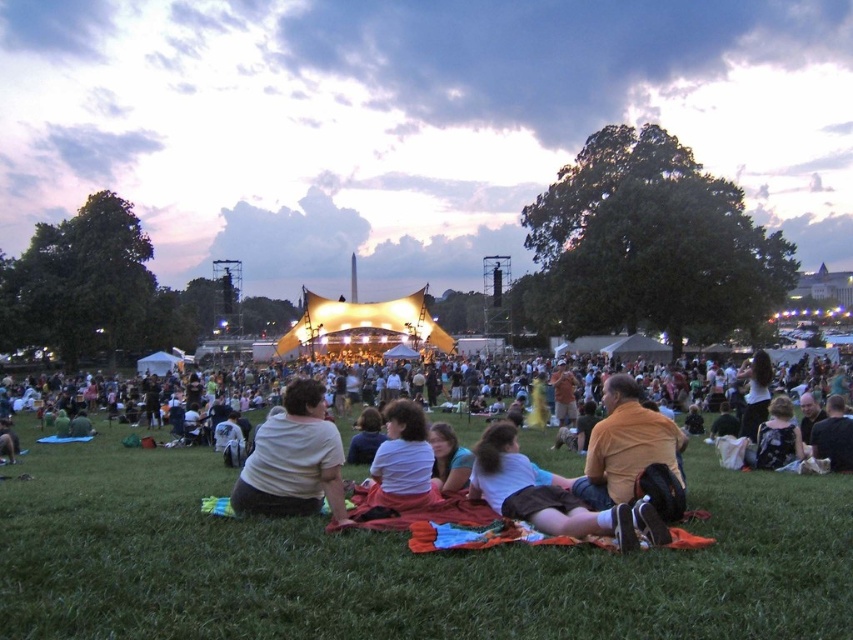
Question: Can you confirm if white matte shirt at center is positioned above light brown hair at center?

Choices:
 (A) no
 (B) yes

Answer: (B)

Question: Does orange cotton shirt at center appear under printed floral dress at lower right?

Choices:
 (A) yes
 (B) no

Answer: (A)

Question: Which point appears closest to the camera in this image?

Choices:
 (A) (0, 620)
 (B) (415, 403)
 (C) (786, 460)

Answer: (A)

Question: Which object is the farthest from the white cotton shirt at center?

Choices:
 (A) printed floral dress at lower right
 (B) light brown hair at center

Answer: (A)

Question: Which point is closer to the camera taking this photo?

Choices:
 (A) (633, 410)
 (B) (787, 397)

Answer: (A)

Question: Is orange cotton shirt at lower center behind light brown hair at center?

Choices:
 (A) no
 (B) yes

Answer: (A)